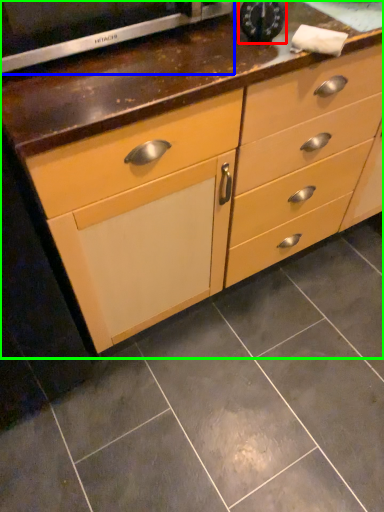
Question: Which object is positioned closest to appliance (highlighted by a red box)? Select from appliance (highlighted by a blue box) and chest of drawers (highlighted by a green box).

Choices:
 (A) appliance
 (B) chest of drawers

Answer: (A)